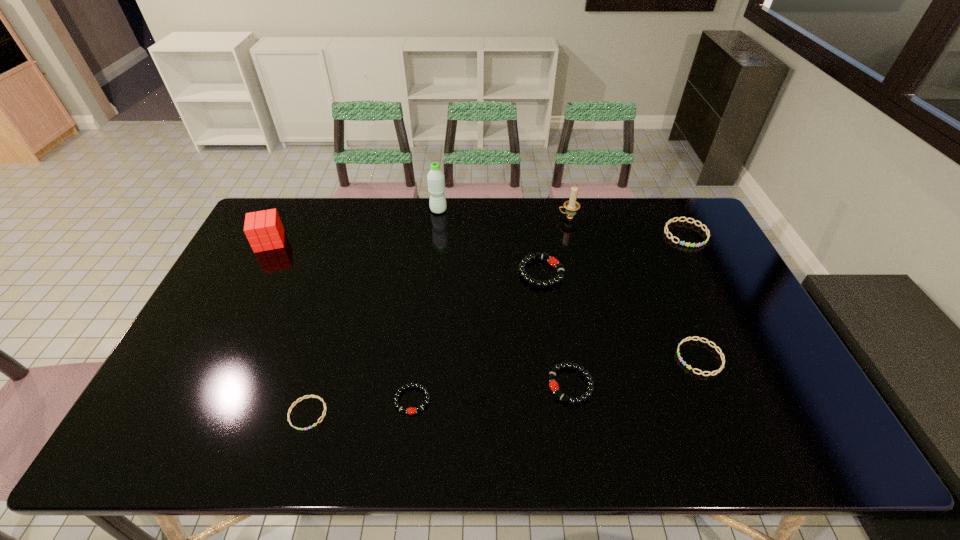
Find the location of a particular element. The image size is (960, 540). vacant space positioned on the right of the biggest black bracelet is located at coordinates (614, 272).

Where is `vacant space located on the surface of the biggest blue bracelet showing star-shaped elements`? vacant space located on the surface of the biggest blue bracelet showing star-shaped elements is located at coordinates (712, 284).

I want to click on blank space located 0.400m on the left of the second biggest black bracelet, so click(x=390, y=385).

Where is `vacant position located on the surface of the second nearest blue bracelet showing star-shaped elements`? The image size is (960, 540). vacant position located on the surface of the second nearest blue bracelet showing star-shaped elements is located at coordinates (564, 357).

Find the location of a particular element. The image size is (960, 540). blank space located on the surface of the second nearest blue bracelet showing star-shaped elements is located at coordinates (602, 357).

Where is `vacant space located 0.130m on the surface of the second nearest blue bracelet showing star-shaped elements`? This screenshot has height=540, width=960. vacant space located 0.130m on the surface of the second nearest blue bracelet showing star-shaped elements is located at coordinates (629, 357).

You are a GUI agent. You are given a task and a screenshot of the screen. Output one action in this format:
    pyautogui.click(x=<x>, y=<y>)
    Task: Click on the free space located on the right of the smallest black bracelet
    Image resolution: width=960 pixels, height=540 pixels.
    Given the screenshot: What is the action you would take?
    pyautogui.click(x=455, y=400)

The image size is (960, 540). What are the coordinates of `water bottle that is positioned at the far edge` in the screenshot? It's located at (436, 179).

Where is `candle_holder positioned at the far edge`? This screenshot has width=960, height=540. candle_holder positioned at the far edge is located at coordinates (571, 206).

Image resolution: width=960 pixels, height=540 pixels. I want to click on cube situated at the far edge, so click(x=264, y=230).